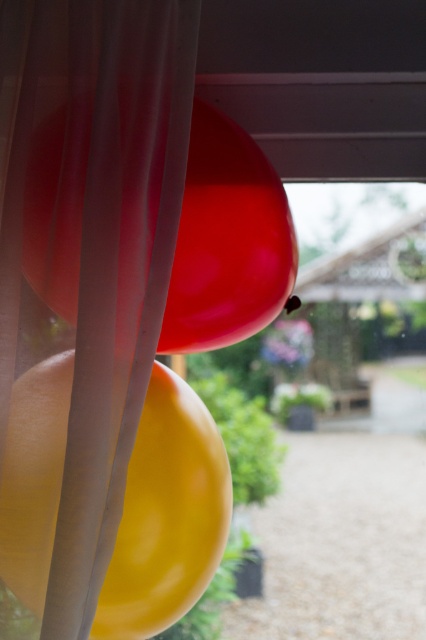
Does translucent sheer curtain at left come in front of glossy rubber balloon at center?

Yes, translucent sheer curtain at left is closer to the viewer.

Between translucent sheer curtain at left and glossy rubber balloon at center, which one appears on the left side from the viewer's perspective?

translucent sheer curtain at left

Between point (158, 179) and point (198, 328), which one is positioned behind?

Positioned behind is point (198, 328).

Where is `translucent sheer curtain at left`? Image resolution: width=426 pixels, height=640 pixels. translucent sheer curtain at left is located at coordinates (94, 240).

Does glossy yellow balloon at center have a greater width compared to glossy rubber balloon at center?

In fact, glossy yellow balloon at center might be narrower than glossy rubber balloon at center.

Based on the photo, who is more distant from viewer, (206, 408) or (219, 248)?

The point (206, 408) is more distant.

Find the location of a particular element. The width and height of the screenshot is (426, 640). glossy yellow balloon at center is located at coordinates (166, 515).

Is translucent sheer curtain at left bigger than glossy yellow balloon at center?

No.

Can you confirm if translucent sheer curtain at left is taller than glossy yellow balloon at center?

Correct, translucent sheer curtain at left is much taller as glossy yellow balloon at center.

I want to click on translucent sheer curtain at left, so click(94, 240).